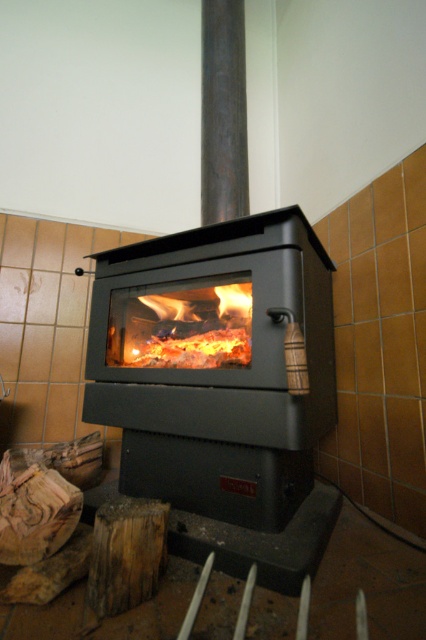
Based on the photo, between orange glowing wood at center and wooden log at lower left, which one is positioned higher?

Positioned higher is orange glowing wood at center.

Who is more forward, (x=143, y=330) or (x=60, y=483)?

Positioned in front is point (x=60, y=483).

Identify the location of orange glowing wood at center. The image size is (426, 640). (181, 324).

Between point (189, 492) and point (152, 362), which one is positioned behind?

The point (152, 362) is more distant.

Between matte black fireplace at center and orange glowing wood at center, which one has more height?

matte black fireplace at center is taller.

Is point (268, 484) in front of point (232, 310)?

That is True.

Identify the location of matte black fireplace at center. (215, 365).

Is point (101, 552) positioned after point (3, 458)?

No, (101, 552) is in front of (3, 458).

Does weathered wood at lower left appear under wooden log at lower left?

Yes, weathered wood at lower left is below wooden log at lower left.

Is point (117, 548) in front of point (14, 557)?

Yes, point (117, 548) is closer to viewer.

This screenshot has width=426, height=640. I want to click on weathered wood at lower left, so click(126, 554).